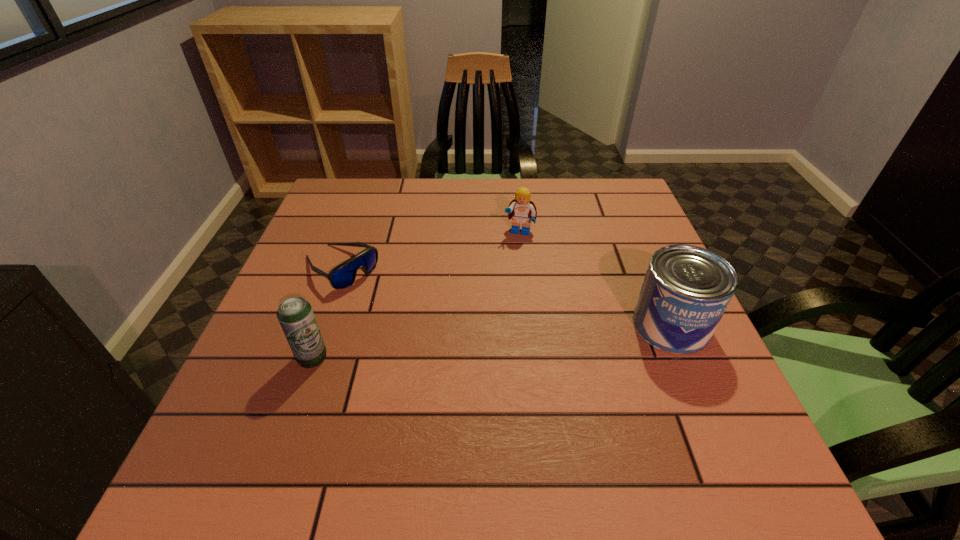
Locate an element on the screen. This screenshot has height=540, width=960. vacant space on the desktop that is between the beer can and the can and is positioned on the front-facing side of the Lego is located at coordinates (492, 341).

Find the location of `free space on the desktop that is between the beer can and the can and is positioned on the front-facing side of the shortest object`. free space on the desktop that is between the beer can and the can and is positioned on the front-facing side of the shortest object is located at coordinates (450, 345).